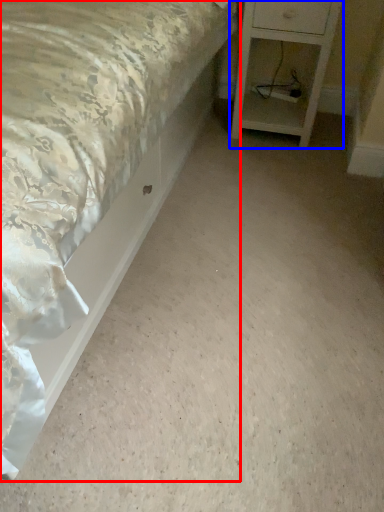
Question: Which object appears farthest to the camera in this image, bed (highlighted by a red box) or nightstand (highlighted by a blue box)?

Choices:
 (A) bed
 (B) nightstand

Answer: (B)